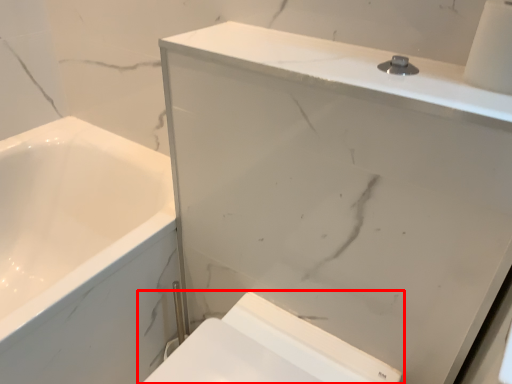
Question: From the image's perspective, where is toilet (annotated by the red box) located in relation to medicine cabinet in the image?

Choices:
 (A) below
 (B) above

Answer: (A)